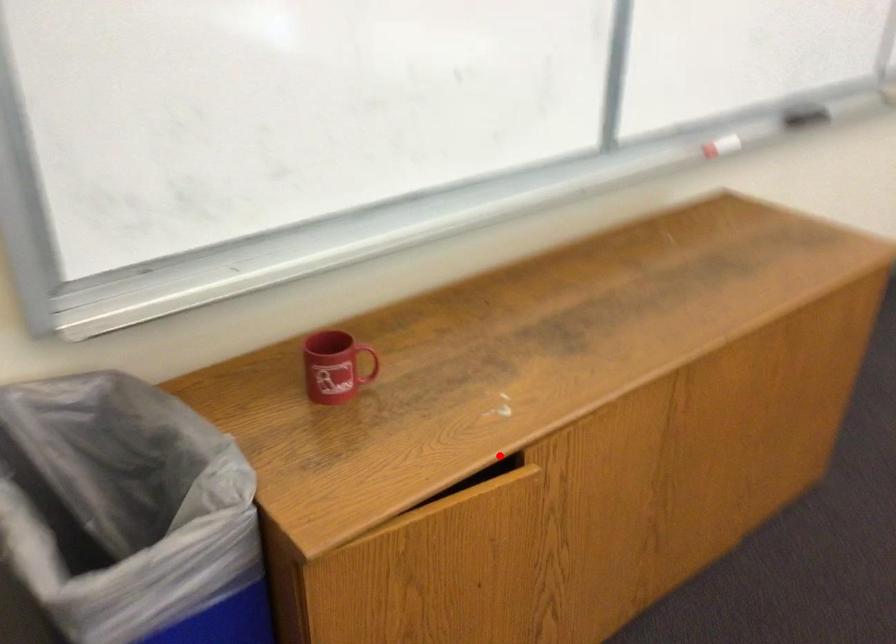
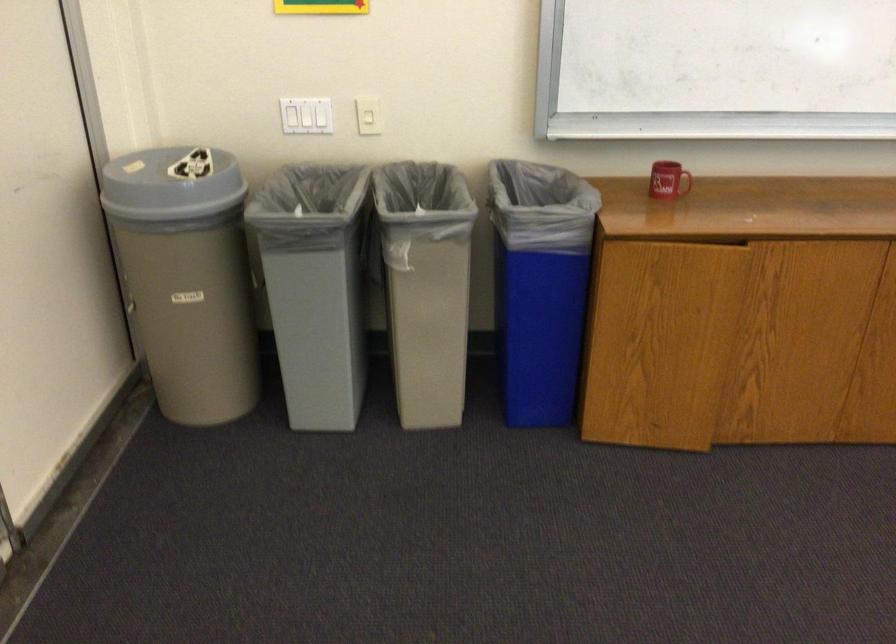
Locate, in the second image, the point that corresponds to the highlighted location in the first image.

(736, 242)